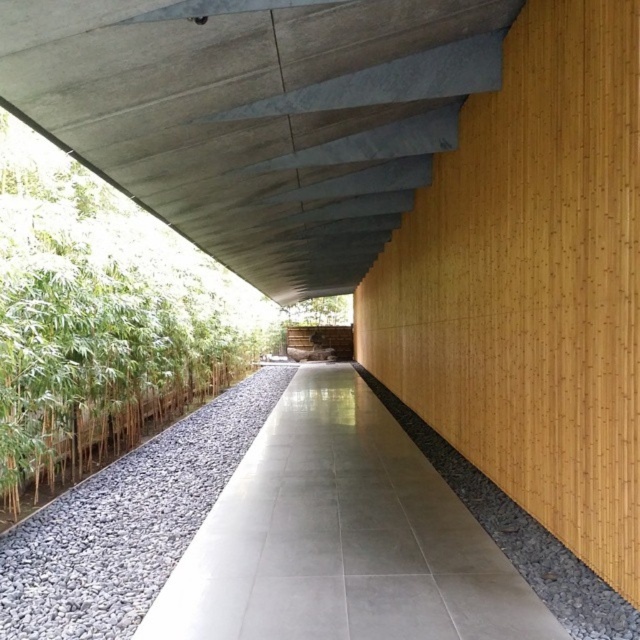
You are standing in the corridor and want to touch the concrete ceiling at upper center. Can you reach it if your height is 5 feet 10 inches?

The concrete ceiling at upper center is 7.94 feet from viewer. Since your height is 5 feet 10 inches, which is approximately 5.83 feet, you can easily reach it because the ceiling is higher than your height.

Looking at this image, you are standing at the entrance of the corridor and want to walk towards the bamboo plants on the opposite side. Which surface will you step on first, the gray concrete path at center or the gray gravel at lower center?

You will step on the gray concrete path at center first because it is closer to you than the gray gravel at lower center, which is further away.